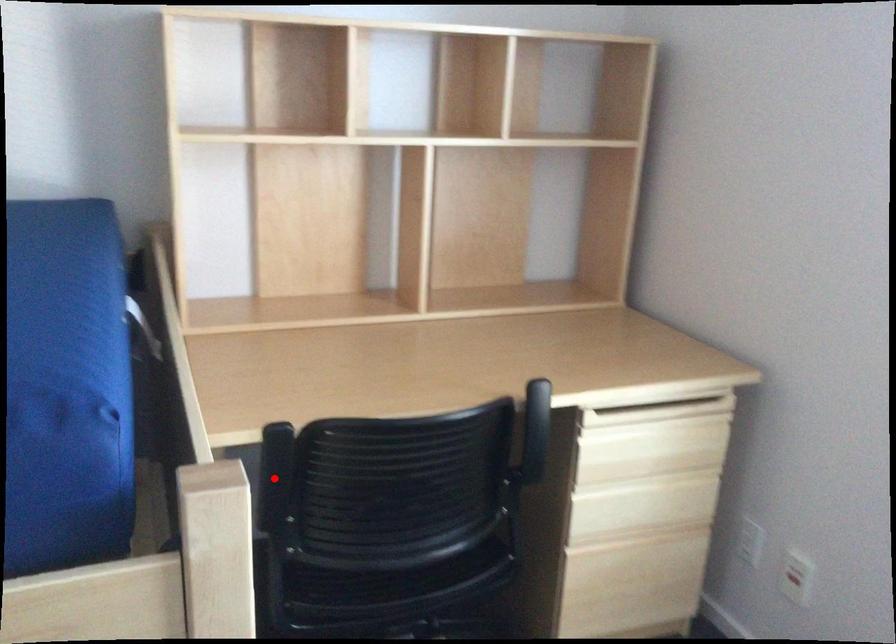
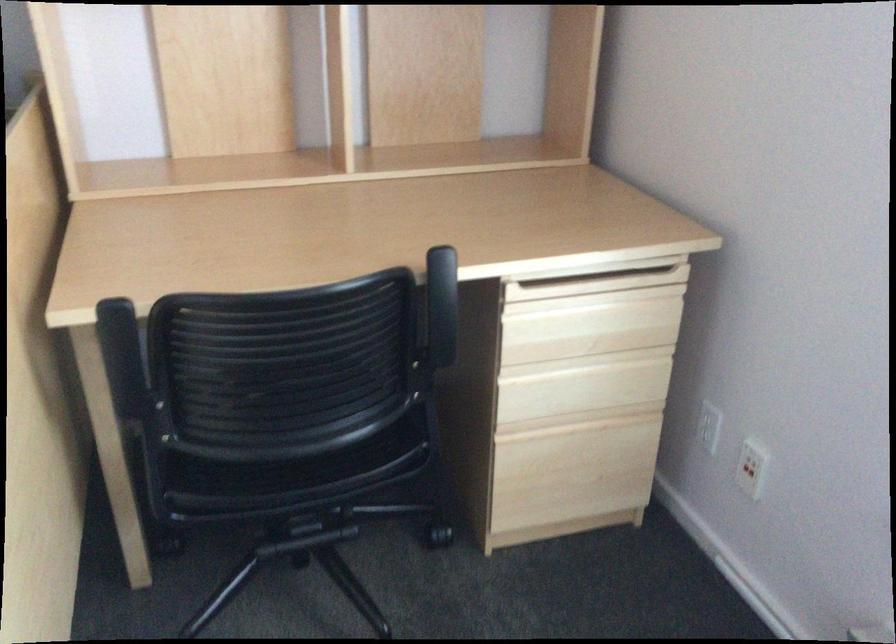
Question: I am providing you with two images of the same scene from different viewpoints. Given a red point in image1, look at the same physical point in image2. Is it:

Choices:
 (A) Closer to the viewpoint
 (B) Farther from the viewpoint

Answer: (A)